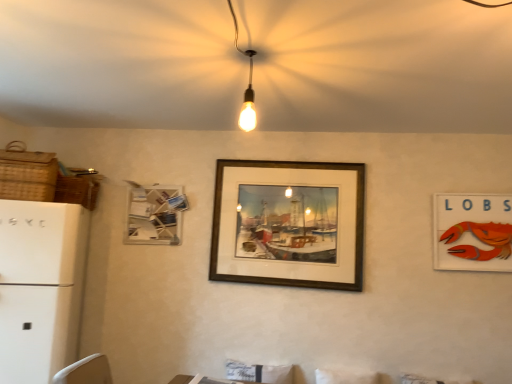
Question: From the image's perspective, is woven brown basket at upper left, placed as the second basket when sorted from front to back, on wooden frame at center, arranged as the 2th picture frame when viewed from the right?

Choices:
 (A) yes
 (B) no

Answer: (A)

Question: Does woven brown basket at upper left, marked as the first basket in a back-to-front arrangement, appear on the right side of wooden frame at center, arranged as the 2th picture frame when viewed from the right?

Choices:
 (A) no
 (B) yes

Answer: (A)

Question: Does woven brown basket at upper left, placed as the second basket when sorted from front to back, have a lesser width compared to wooden frame at center, arranged as the 2th picture frame when viewed from the right?

Choices:
 (A) yes
 (B) no

Answer: (B)

Question: Would you say woven brown basket at upper left, placed as the second basket when sorted from front to back, contains wooden frame at center, arranged as the 2th picture frame when viewed from the right?

Choices:
 (A) no
 (B) yes

Answer: (A)

Question: Is woven brown basket at upper left, marked as the first basket in a back-to-front arrangement, directly adjacent to wooden frame at center, the second picture frame viewed from the left?

Choices:
 (A) yes
 (B) no

Answer: (B)

Question: Is woven brown basket at upper left, placed as the second basket when sorted from front to back, far from wooden frame at center, the second picture frame viewed from the left?

Choices:
 (A) no
 (B) yes

Answer: (B)

Question: Can you confirm if woven brown basket at left, which is the first basket from front to back, is taller than wooden frame at center, the second picture frame viewed from the left?

Choices:
 (A) yes
 (B) no

Answer: (B)

Question: Is woven brown basket at left, the 2th basket from the back, wider than wooden frame at center, the second picture frame viewed from the left?

Choices:
 (A) yes
 (B) no

Answer: (A)

Question: Considering the relative sizes of woven brown basket at left, which is the first basket from front to back, and wooden frame at center, arranged as the 2th picture frame when viewed from the right, in the image provided, is woven brown basket at left, which is the first basket from front to back, thinner than wooden frame at center, arranged as the 2th picture frame when viewed from the right,?

Choices:
 (A) no
 (B) yes

Answer: (A)

Question: Is woven brown basket at left, the 2th basket from the back, outside of wooden frame at center, the second picture frame viewed from the left?

Choices:
 (A) no
 (B) yes

Answer: (B)

Question: Is woven brown basket at left, the 2th basket from the back, shorter than wooden frame at center, the second picture frame viewed from the left?

Choices:
 (A) no
 (B) yes

Answer: (B)

Question: Is woven brown basket at left, which is the first basket from front to back, touching wooden frame at center, arranged as the 2th picture frame when viewed from the right?

Choices:
 (A) yes
 (B) no

Answer: (B)

Question: From a real-world perspective, is white matte refrigerator at left physically above white matte picture frame at upper left, which is the 3th picture frame from right to left?

Choices:
 (A) yes
 (B) no

Answer: (B)